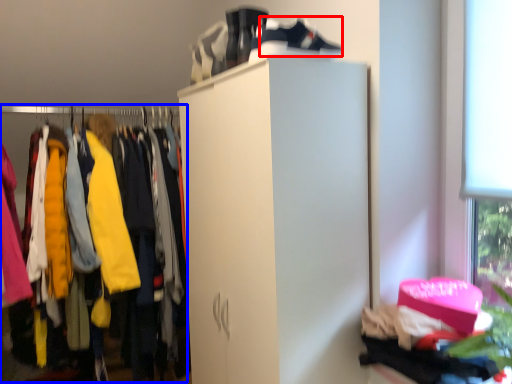
Question: Which object is closer to the camera taking this photo, shoe (highlighted by a red box) or closet (highlighted by a blue box)?

Choices:
 (A) shoe
 (B) closet

Answer: (A)